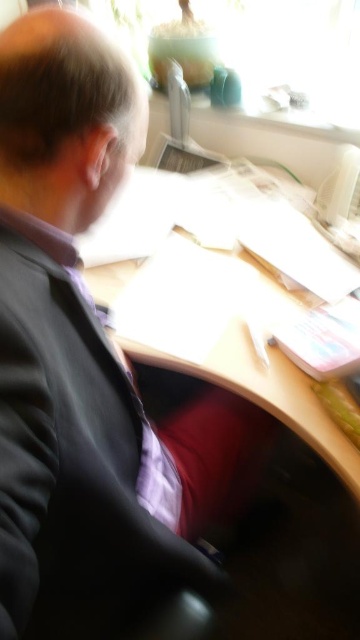
Question: In this image, where is black matte suit at center located relative to wooden desk at center?

Choices:
 (A) right
 (B) left

Answer: (B)

Question: Among these points, which one is farthest from the camera?

Choices:
 (A) (29, 248)
 (B) (222, 344)

Answer: (B)

Question: Among these objects, which one is farthest from the camera?

Choices:
 (A) black matte suit at center
 (B) wooden desk at center

Answer: (B)

Question: Does black matte suit at center appear on the right side of wooden desk at center?

Choices:
 (A) yes
 (B) no

Answer: (B)

Question: Does black matte suit at center appear under wooden desk at center?

Choices:
 (A) yes
 (B) no

Answer: (A)